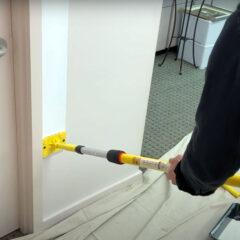
Where is `door`? The image size is (240, 240). door is located at coordinates (7, 119).